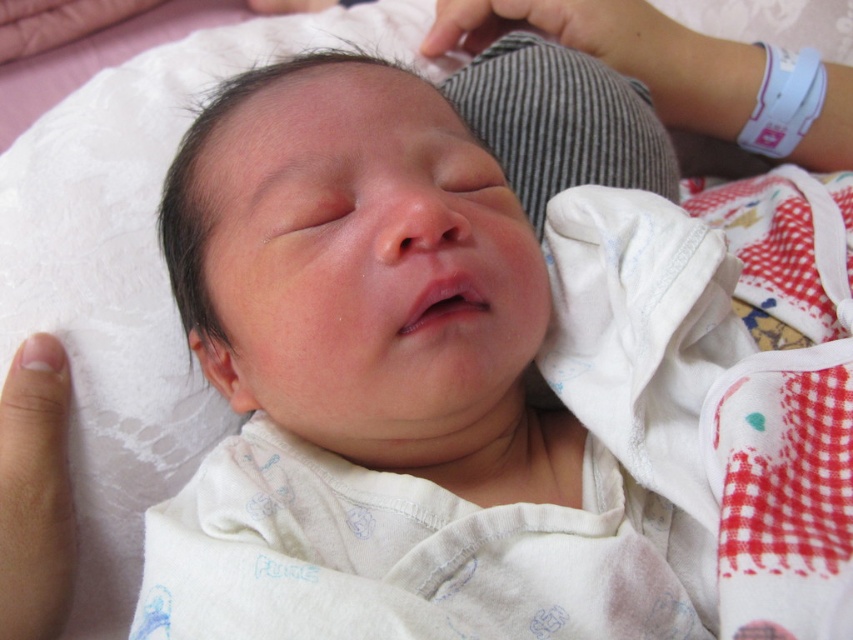
You are a nurse observing a newborn in the nursery. You notice the smooth skin newborn at center and the smooth skin finger at lower left. Which object is located more to the right side?

The smooth skin newborn at center is positioned on the right side of the smooth skin finger at lower left, so the smooth skin newborn at center is more to the right.

You are a pediatrician examining a newborn. You notice the smooth skin newborn at center and the smooth skin finger at lower left in the image. Which object has a greater width?

The smooth skin newborn at center has a greater width than the smooth skin finger at lower left.